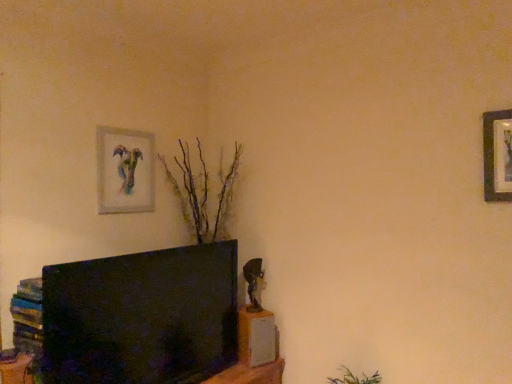
Question: From the image's perspective, is wooden picture frame at upper right, the 2th picture frame in the back-to-front sequence, on top of watercolor paper painting at upper left, the 1th picture frame in the left-to-right sequence?

Choices:
 (A) yes
 (B) no

Answer: (A)

Question: Is wooden picture frame at upper right, the 2th picture frame in the back-to-front sequence, at the left side of watercolor paper painting at upper left, arranged as the 2th picture frame when viewed from the front?

Choices:
 (A) no
 (B) yes

Answer: (A)

Question: Is wooden picture frame at upper right, the 2th picture frame in the back-to-front sequence, with watercolor paper painting at upper left, the second picture frame in the right-to-left sequence?

Choices:
 (A) no
 (B) yes

Answer: (A)

Question: Is wooden picture frame at upper right, the first picture frame from the front, facing away from watercolor paper painting at upper left, the second picture frame in the right-to-left sequence?

Choices:
 (A) no
 (B) yes

Answer: (A)

Question: Considering the relative sizes of wooden picture frame at upper right, the first picture frame from the front, and watercolor paper painting at upper left, arranged as the 2th picture frame when viewed from the front, in the image provided, is wooden picture frame at upper right, the first picture frame from the front, smaller than watercolor paper painting at upper left, arranged as the 2th picture frame when viewed from the front,?

Choices:
 (A) no
 (B) yes

Answer: (A)

Question: From the image's perspective, is wooden bookshelf at lower left located above or below wooden picture frame at upper right, the 2th picture frame in the back-to-front sequence?

Choices:
 (A) below
 (B) above

Answer: (A)

Question: Which is correct: wooden bookshelf at lower left is inside wooden picture frame at upper right, which is the 2th picture frame in left-to-right order, or outside of it?

Choices:
 (A) inside
 (B) outside

Answer: (B)

Question: In the image, is wooden bookshelf at lower left positioned in front of or behind wooden picture frame at upper right, the first picture frame from the front?

Choices:
 (A) front
 (B) behind

Answer: (B)

Question: In terms of height, does wooden bookshelf at lower left look taller or shorter compared to wooden picture frame at upper right, which is the 2th picture frame in left-to-right order?

Choices:
 (A) tall
 (B) short

Answer: (B)

Question: Is wooden picture frame at upper right, the 2th picture frame in the back-to-front sequence, taller or shorter than wooden bookshelf at lower left?

Choices:
 (A) tall
 (B) short

Answer: (A)

Question: In terms of size, does wooden picture frame at upper right, which is the 2th picture frame in left-to-right order, appear bigger or smaller than wooden bookshelf at lower left?

Choices:
 (A) small
 (B) big

Answer: (B)

Question: From a real-world perspective, is wooden picture frame at upper right, the 1th picture frame in the right-to-left sequence, physically located above or below wooden bookshelf at lower left?

Choices:
 (A) above
 (B) below

Answer: (A)

Question: Considering the relative positions of wooden picture frame at upper right, the 1th picture frame in the right-to-left sequence, and wooden bookshelf at lower left in the image provided, is wooden picture frame at upper right, the 1th picture frame in the right-to-left sequence, to the left or to the right of wooden bookshelf at lower left?

Choices:
 (A) right
 (B) left

Answer: (A)

Question: From the image's perspective, is watercolor paper painting at upper left, arranged as the 2th picture frame when viewed from the front, positioned above or below wooden bookshelf at lower left?

Choices:
 (A) below
 (B) above

Answer: (B)

Question: From a real-world perspective, is watercolor paper painting at upper left, the 1th picture frame in the left-to-right sequence, physically located above or below wooden bookshelf at lower left?

Choices:
 (A) below
 (B) above

Answer: (B)